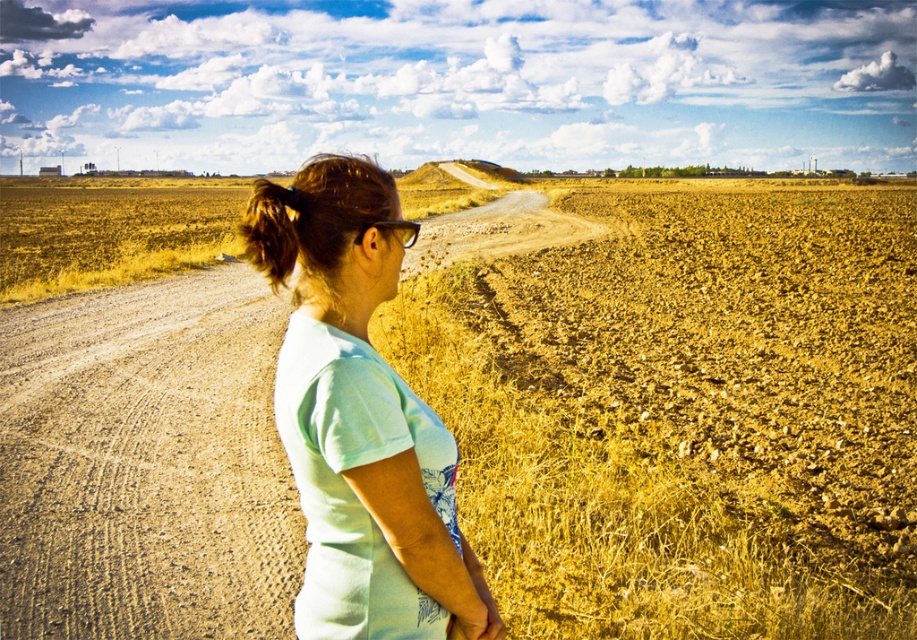
You are standing at the center of the image and want to walk to the brown gravel dirt track at left. In which direction should you move relative to your current position?

The brown gravel dirt track at left is located at coordinates point (146, 464), so you should move to the left and slightly downward from your current position at the center.

You are a photographer standing in the middle of the scene. You want to place a small tripod on the ground between the brown gravel dirt track at left and the black plastic glasses at center. Which object should you place the tripod closer to so it doesn

The brown gravel dirt track at left is taller than the black plastic glasses at center. To ensure the tripod is placed on stable ground, you should place it closer to the brown gravel dirt track at left since it has a higher elevation and firmer surface compared to the black plastic glasses at center.